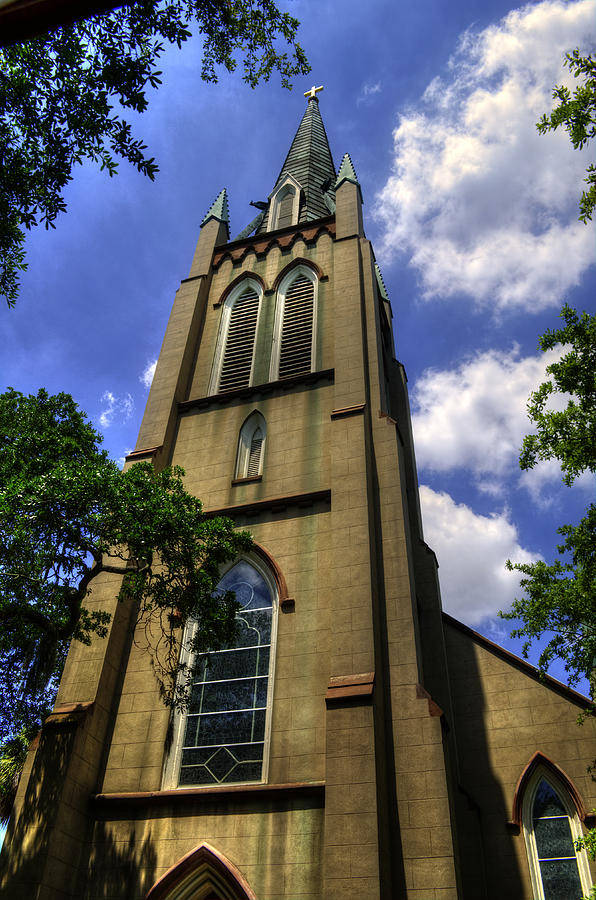
Find the location of a particular element. This screenshot has width=596, height=900. window shutters is located at coordinates point(257,448), point(244,322), point(303,304).